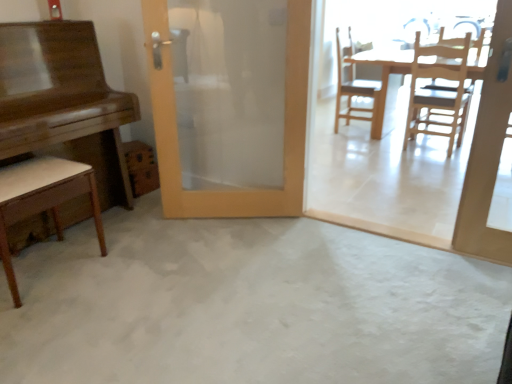
Question: In terms of size, does wooden door at center appear bigger or smaller than light brown wood chair at lower left, which appears as the 3th chair when viewed from the right?

Choices:
 (A) big
 (B) small

Answer: (A)

Question: From a real-world perspective, is wooden door at center above or below light brown wood chair at lower left, which ranks as the 3th chair in back-to-front order?

Choices:
 (A) below
 (B) above

Answer: (B)

Question: Which object is positioned closest to the light wood table at center, which is the 2th table in front-to-back order?

Choices:
 (A) light brown wood chair at lower left, arranged as the first chair when viewed from the left
 (B) wooden door at center
 (C) shiny brown piano at left, which is the first table in front-to-back order
 (D) white concrete floor at center
 (E) wooden at right, which is the second chair from left to right

Answer: (E)

Question: Estimate the real-world distances between objects in this image. Which object is closer to the wooden at right, the second chair in the right-to-left sequence?

Choices:
 (A) wooden door at center
 (B) light wood table at center, the second table when ordered from left to right
 (C) wooden chair at right, the first chair viewed from the right
 (D) white concrete floor at center
 (E) light brown wood chair at lower left, which ranks as the 3th chair in back-to-front order

Answer: (B)